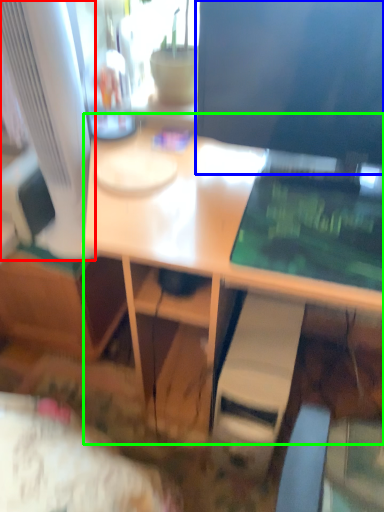
Question: Estimate the real-world distances between objects in this image. Which object is farther from computer monitor (highlighted by a red box), computer monitor (highlighted by a blue box) or desk (highlighted by a green box)?

Choices:
 (A) computer monitor
 (B) desk

Answer: (A)